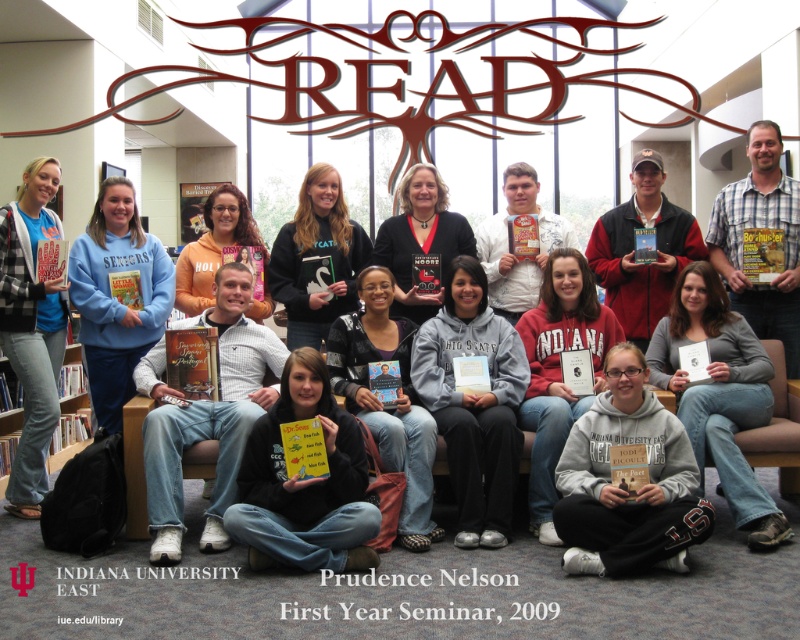
Which of these two, gray fleece sweatshirt at lower center or matte black hoodie at center, stands taller?

Standing taller between the two is matte black hoodie at center.

From the picture: Which is more to the left, gray fleece sweatshirt at lower center or matte black hoodie at center?

matte black hoodie at center is more to the left.

Is point (670, 490) positioned in front of point (354, 547)?

Yes, it is in front of point (354, 547).

Image resolution: width=800 pixels, height=640 pixels. Find the location of `gray fleece sweatshirt at lower center`. gray fleece sweatshirt at lower center is located at coordinates (624, 490).

The width and height of the screenshot is (800, 640). What do you see at coordinates (720, 394) in the screenshot?
I see `gray fleece sweatshirt at lower right` at bounding box center [720, 394].

Who is more forward, [704,330] or [28,346]?

Point [28,346]

Between point (741, 528) and point (28, 180), which one is positioned in front?

Point (741, 528) is in front.

The height and width of the screenshot is (640, 800). I want to click on gray fleece sweatshirt at lower right, so click(720, 394).

Does matte black hoodie at center appear under white striped shirt at center?

Correct, matte black hoodie at center is located below white striped shirt at center.

Does matte black hoodie at center have a lesser width compared to white striped shirt at center?

Correct, matte black hoodie at center's width is less than white striped shirt at center's.

Who is more distant from viewer, (296, 564) or (252, 385)?

Positioned behind is point (252, 385).

In order to click on matte black hoodie at center in this screenshot , I will do `click(304, 483)`.